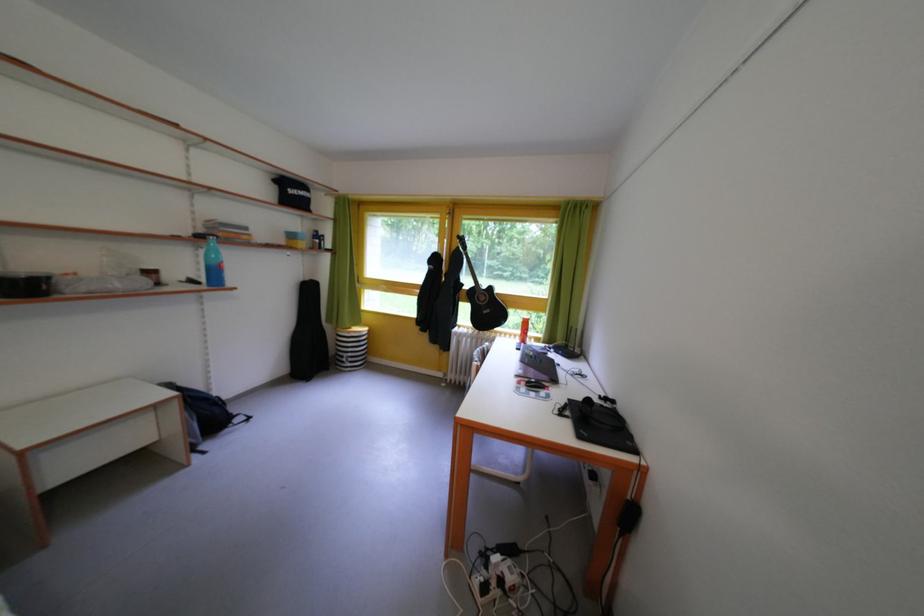
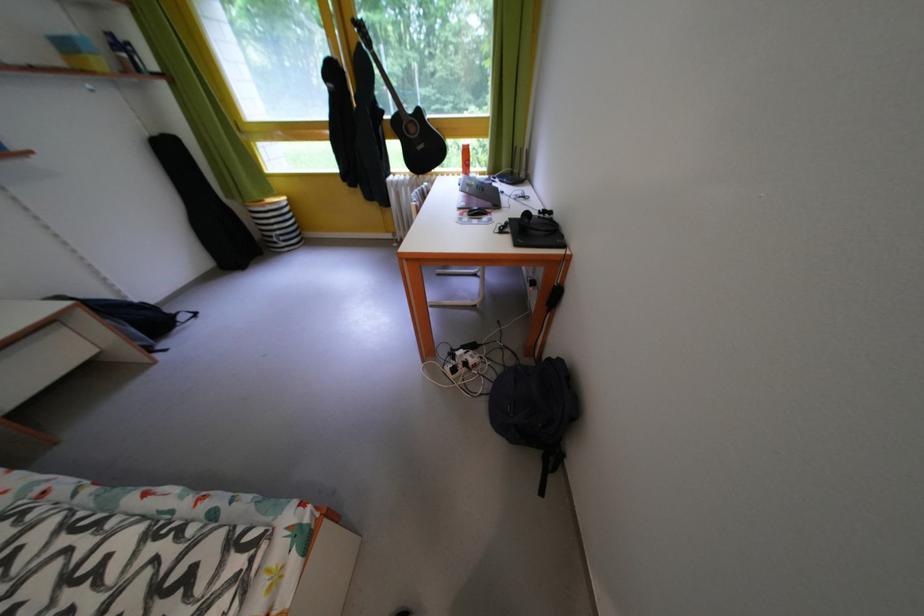
Find the pixel in the second image that matches (x=318, y=285) in the first image.

(165, 139)